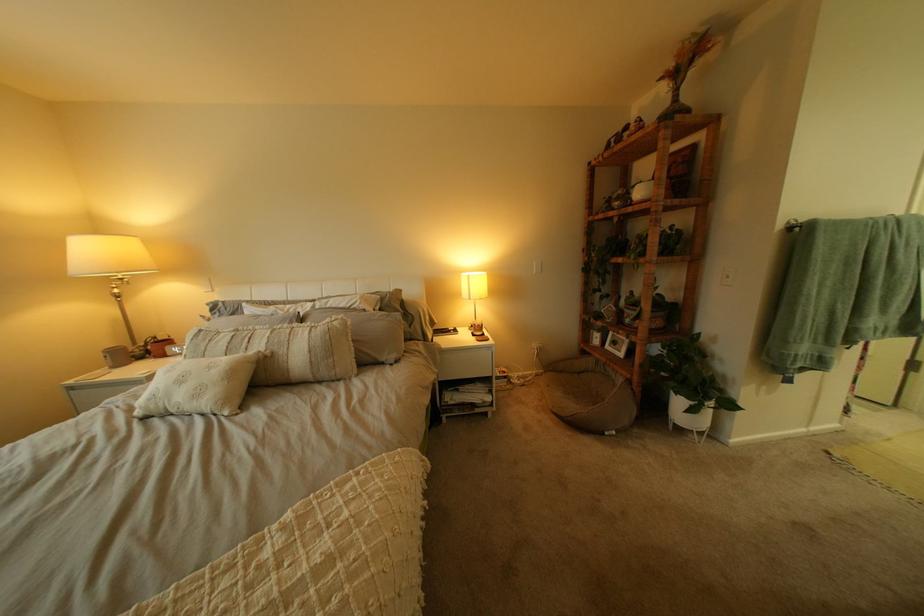
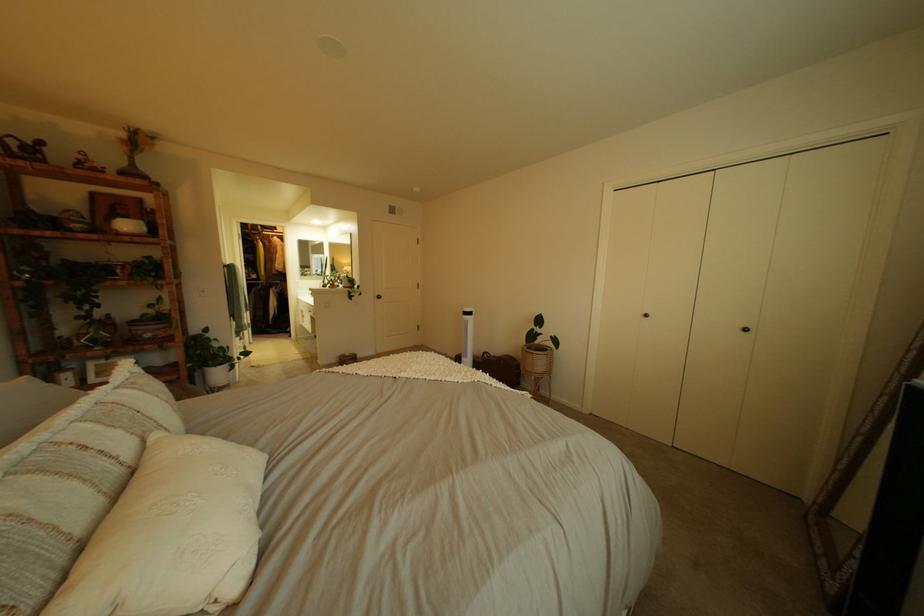
In the second image, find the point that corresponds to (x=645, y=377) in the first image.

(189, 379)